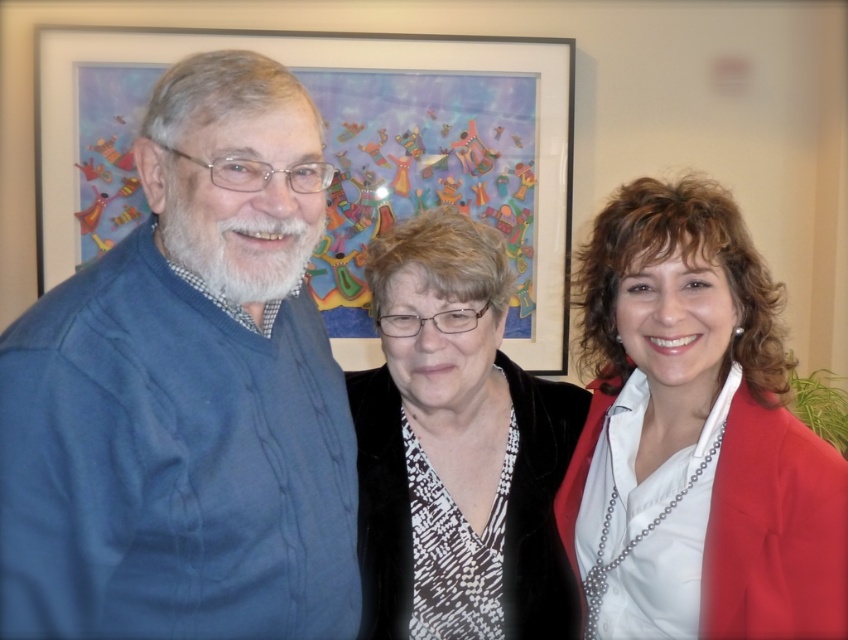
Is white glossy shirt at center bigger than velvet black jacket at center?

Yes, white glossy shirt at center is bigger than velvet black jacket at center.

Who is more distant from viewer, [704,228] or [455,634]?

The point [455,634] is behind.

At what (x,y) coordinates should I click in order to perform the action: click on white glossy shirt at center. Please return your answer as a coordinate pair (x, y). Looking at the image, I should click on (695, 435).

Where is `corduroy sweater at left`? corduroy sweater at left is located at coordinates (187, 394).

Can you confirm if corduroy sweater at left is taller than white glossy shirt at center?

Indeed, corduroy sweater at left has a greater height compared to white glossy shirt at center.

Between point (352, 508) and point (771, 433), which one is positioned in front?

Point (771, 433) is in front.

Image resolution: width=848 pixels, height=640 pixels. I want to click on corduroy sweater at left, so click(x=187, y=394).

Is point (265, 324) positioned behind point (461, 144)?

No, (265, 324) is in front of (461, 144).

Between corduroy sweater at left and wooden picture frame at upper center, which one appears on the right side from the viewer's perspective?

Positioned to the right is corduroy sweater at left.

This screenshot has width=848, height=640. What are the coordinates of `corduroy sweater at left` in the screenshot? It's located at (187, 394).